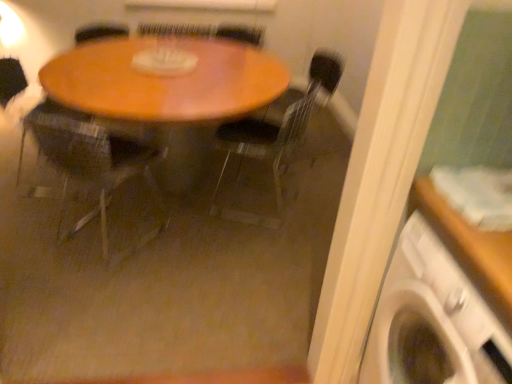
Question: In the image, is white plastic washing machine at lower right positioned in front of or behind wooden table at center?

Choices:
 (A) front
 (B) behind

Answer: (A)

Question: Visually, is white plastic washing machine at lower right positioned to the left or to the right of wooden table at center?

Choices:
 (A) left
 (B) right

Answer: (B)

Question: Estimate the real-world distances between objects in this image. Which object is farther from the white plastic washing machine at lower right?

Choices:
 (A) transparent plastic chair at center, the 2th chair from the left
 (B) wooden table at center
 (C) wooden chair at center, marked as the second chair in a right-to-left arrangement
 (D) wooden armchair at center

Answer: (D)

Question: Estimate the real-world distances between objects in this image. Which object is farther from the white plastic washing machine at lower right?

Choices:
 (A) transparent plastic chair at center, the 2th chair from the left
 (B) wooden chair at center, which appears as the first chair when viewed from the left
 (C) wooden armchair at center
 (D) wooden table at center

Answer: (C)